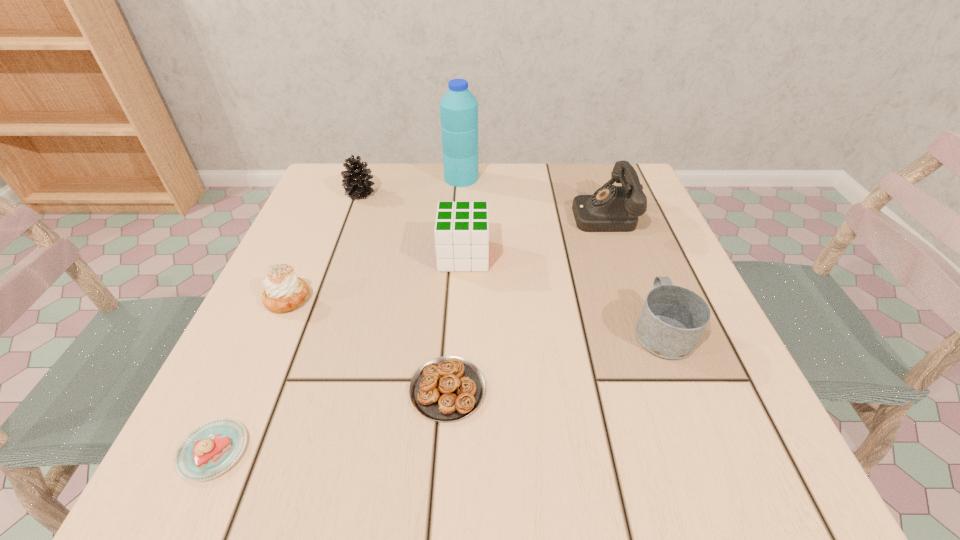
This screenshot has height=540, width=960. What are the coordinates of `the tallest object` in the screenshot? It's located at [x=458, y=108].

I want to click on telephone, so click(611, 208).

This screenshot has width=960, height=540. I want to click on pinecone, so click(356, 182).

Identify the location of cube. (461, 232).

At what (x,y) coordinates should I click in order to perform the action: click on mug. Please return your answer as a coordinate pair (x, y). The height and width of the screenshot is (540, 960). Looking at the image, I should click on (673, 319).

This screenshot has height=540, width=960. What are the coordinates of `the tallest pastry` in the screenshot? It's located at (284, 291).

This screenshot has width=960, height=540. I want to click on the rightmost pastry, so click(445, 389).

The height and width of the screenshot is (540, 960). Identify the location of the shortest object. (212, 448).

Where is `free space located 0.300m on the right of the tallest object`? The height and width of the screenshot is (540, 960). free space located 0.300m on the right of the tallest object is located at coordinates (600, 178).

Find the location of a particular element. blank space located on the dial of the telephone is located at coordinates (423, 214).